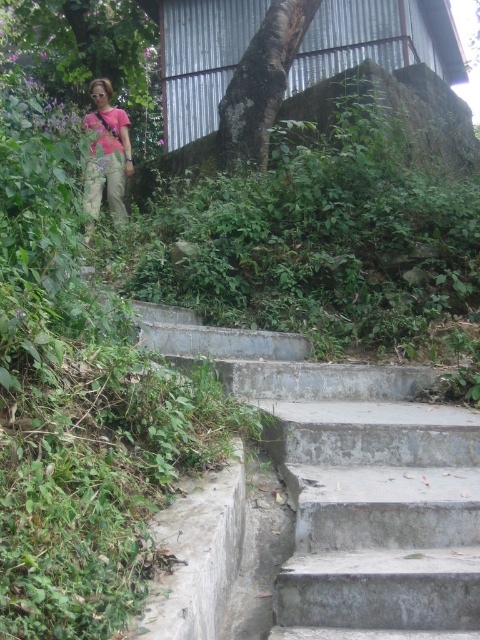
Question: Considering the relative positions of gray concrete stairs at center and pink matte shirt at upper left in the image provided, where is gray concrete stairs at center located with respect to pink matte shirt at upper left?

Choices:
 (A) right
 (B) left

Answer: (A)

Question: Does gray concrete stairs at center have a smaller size compared to dark brown bark tree at center?

Choices:
 (A) yes
 (B) no

Answer: (B)

Question: Estimate the real-world distances between objects in this image. Which object is closer to the dark brown bark tree at center?

Choices:
 (A) gray concrete stairs at center
 (B) pink matte shirt at upper left

Answer: (B)

Question: Among these objects, which one is farthest from the camera?

Choices:
 (A) pink matte shirt at upper left
 (B) gray concrete stairs at center

Answer: (A)

Question: Is dark brown bark tree at center behind pink matte shirt at upper left?

Choices:
 (A) no
 (B) yes

Answer: (B)

Question: Estimate the real-world distances between objects in this image. Which object is farther from the gray concrete stairs at center?

Choices:
 (A) dark brown bark tree at center
 (B) pink matte shirt at upper left

Answer: (B)